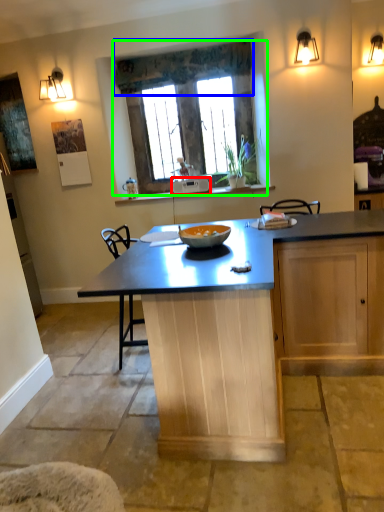
Question: Which object is positioned closest to appliance (highlighted by a red box)? Select from curtain (highlighted by a blue box) and window (highlighted by a green box).

Choices:
 (A) curtain
 (B) window

Answer: (B)